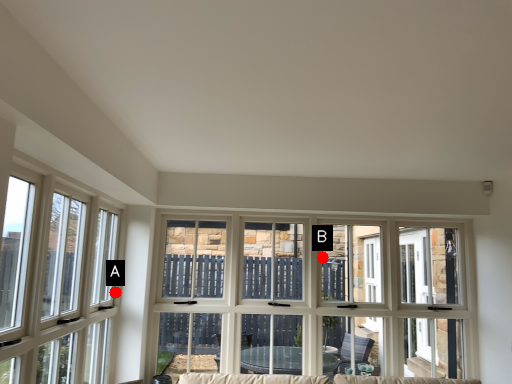
Question: Two points are circled on the image, labeled by A and B beside each circle. Which of the following is the farthest from the observer?

Choices:
 (A) A is further
 (B) B is further

Answer: (B)